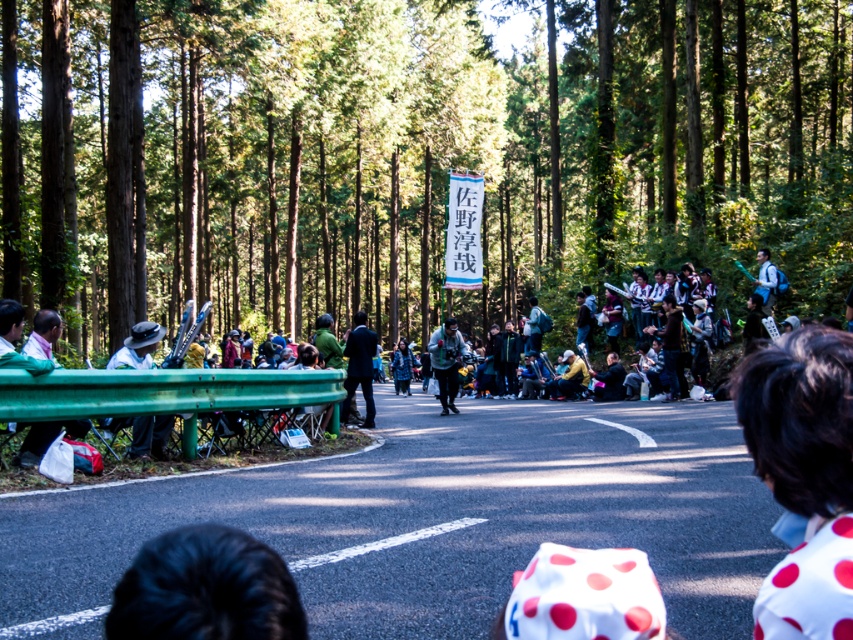
Consider the image. You are standing at the edge of the forest road and see the point marked at coordinates (x=584, y=595). What object does this point indicate?

The point at coordinates (x=584, y=595) corresponds to the white polka dot fabric at center.

You are a photographer positioned at the center of the road during this outdoor event. You want to capture a photo that includes both the white matte hat at left and the green guardrail in the foreground. Based on their positions, which object should appear closer to the left edge of your photo?

The white matte hat at left is located at point (x=137, y=346), which means it is positioned to the left of the green guardrail in the foreground. Therefore, the white matte hat at left will appear closer to the left edge of the photo.

You are a participant in the event and need to move from the starting point to the finish line. The starting point is marked by point (257, 294) and the finish line is marked by point (352, 330). Based on the scene, which direction should you move to reach the finish line from the starting point?

Point (257, 294) is behind point (352, 330). To reach the finish line from the starting point, you should move forward towards the direction of point (352, 330).